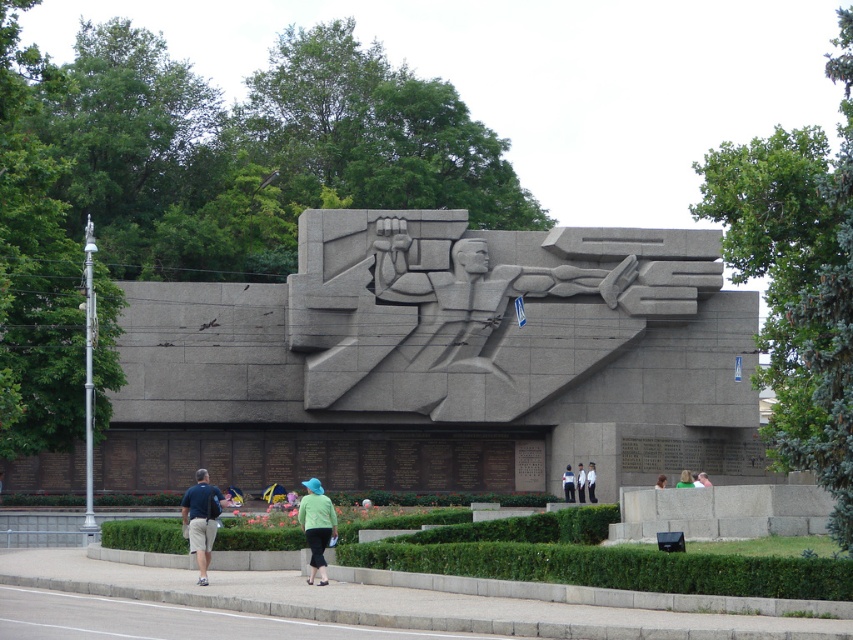
You are a photographer trying to capture both the dark blue shirt at lower left and the green fabric at lower center in a single frame. Which object should you adjust your camera to focus on first if you want to ensure both are in the shot without moving the camera?

You should focus on the dark blue shirt at lower left first because its width is larger than the green fabric at lower center, allowing more room to frame both objects without moving the camera.

You are a photographer standing at the monument. You want to take a photo that includes both the dark blue shirt at lower left and the green fabric at lower center. Given that your camera has a maximum focus range of 20 meters, will you be able to capture both objects in a single focused shot?

The dark blue shirt at lower left is 19.69 meters from the green fabric at lower center. Since the distance between them is within the camera maximum focus range of 20 meters, you can capture both in a single focused shot.